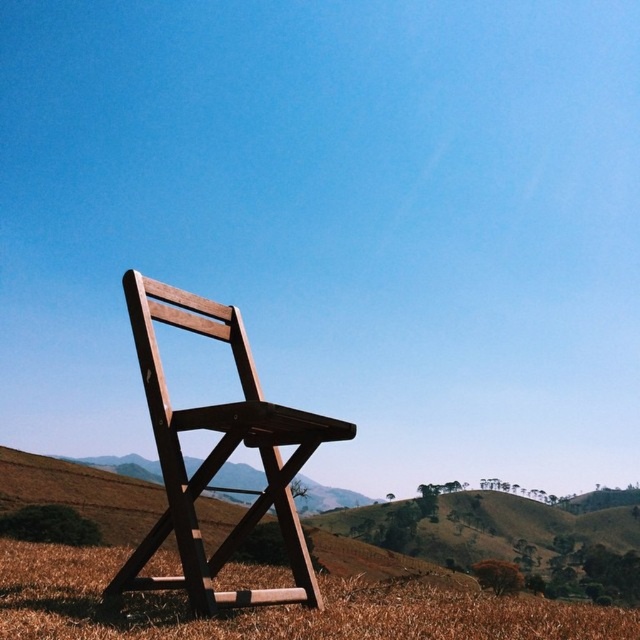
Can you confirm if brown grass at lower center is shorter than wooden folding chair at center?

Yes, brown grass at lower center is shorter than wooden folding chair at center.

In the scene shown: Does brown grass at lower center appear over wooden folding chair at center?

Actually, brown grass at lower center is below wooden folding chair at center.

Between point (326, 627) and point (132, 556), which one is positioned behind?

Positioned behind is point (132, 556).

Locate an element on the screen. brown grass at lower center is located at coordinates (273, 609).